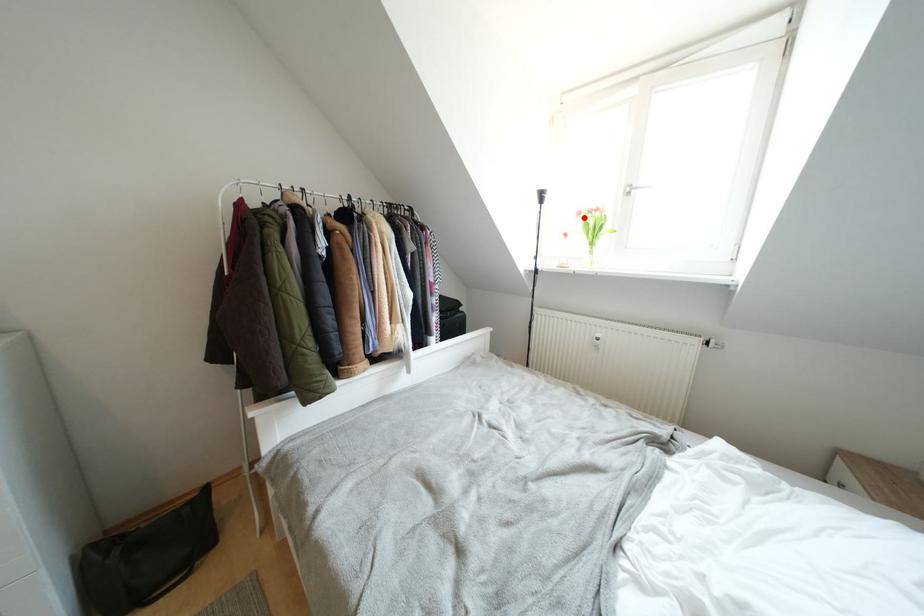
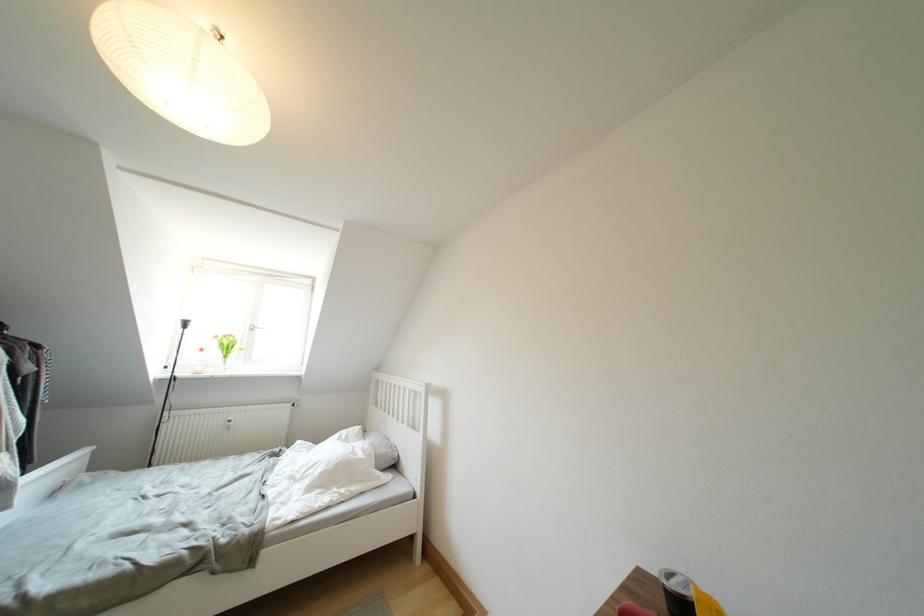
Question: I am providing you with two images of the same scene from different viewpoints. Image1 has a red point marked. In image2, the corresponding 3D location appears at what relative position? Reply with the corresponding letter.

Choices:
 (A) Closer
 (B) Farther

Answer: (B)